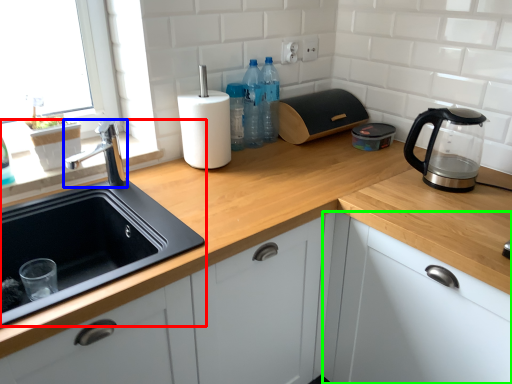
Question: Which object is positioned farthest from sink (highlighted by a red box)? Select from tap (highlighted by a blue box) and cabinetry (highlighted by a green box).

Choices:
 (A) tap
 (B) cabinetry

Answer: (B)